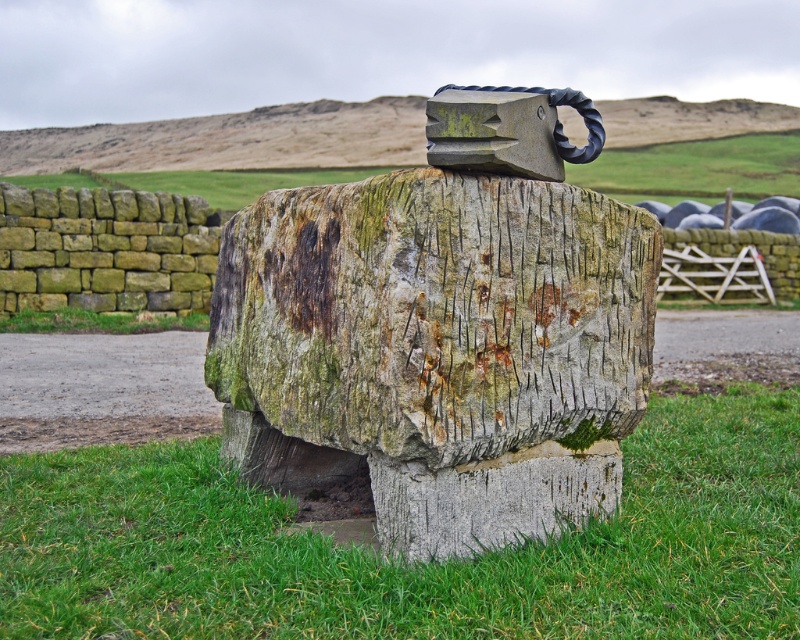
Question: Does green grass at lower center have a lesser width compared to yellowish stone wall at left?

Choices:
 (A) yes
 (B) no

Answer: (B)

Question: Which of the following is the closest to the observer?

Choices:
 (A) yellowish stone wall at left
 (B) green grass at lower center
 (C) green grass at center

Answer: (B)

Question: Among these objects, which one is farthest from the camera?

Choices:
 (A) yellowish stone wall at left
 (B) green grass at lower center

Answer: (A)

Question: Does yellowish stone wall at left have a greater width compared to green grass at center?

Choices:
 (A) no
 (B) yes

Answer: (B)

Question: Is yellowish stone wall at left to the right of green grass at center from the viewer's perspective?

Choices:
 (A) yes
 (B) no

Answer: (B)

Question: Estimate the real-world distances between objects in this image. Which object is closer to the yellowish stone wall at left?

Choices:
 (A) green grass at center
 (B) green grass at lower center

Answer: (A)